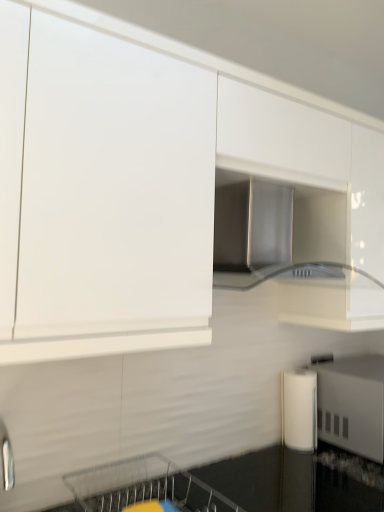
Question: Considering the positions of point (125, 33) and point (89, 468), is point (125, 33) closer or farther from the camera than point (89, 468)?

Choices:
 (A) farther
 (B) closer

Answer: (B)

Question: In terms of width, does white glossy cabinet at upper center look wider or thinner when compared to metallic silver dishwasher at lower center?

Choices:
 (A) wide
 (B) thin

Answer: (B)

Question: Which of these objects is positioned farthest from the metallic silver dishwasher at lower center?

Choices:
 (A) white matte cylindrical container at lower right, which ranks as the second appliance in right-to-left order
 (B) white glossy cabinet at upper center
 (C) stainless steel range hood at center
 (D) black glossy countertop at lower center
 (E) white glossy paper towel dispenser at lower right, placed as the 2th appliance when sorted from left to right

Answer: (C)

Question: Estimate the real-world distances between objects in this image. Which object is farther from the metallic silver dishwasher at lower center?

Choices:
 (A) stainless steel range hood at center
 (B) white glossy paper towel dispenser at lower right, placed as the 2th appliance when sorted from left to right
 (C) white matte cylindrical container at lower right, which ranks as the second appliance in right-to-left order
 (D) white glossy cabinet at upper center
 (E) black glossy countertop at lower center

Answer: (A)